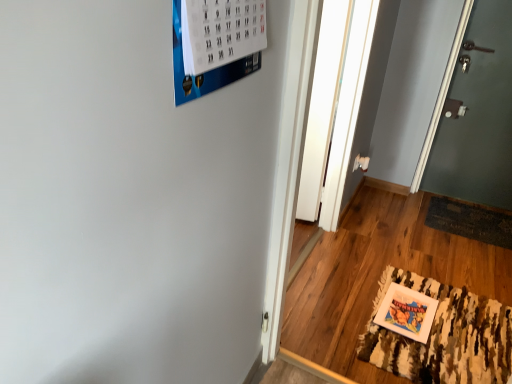
Locate an element on the screen. This screenshot has height=384, width=512. vacant region under dark brown woven mat at lower right (from a real-world perspective) is located at coordinates (467, 218).